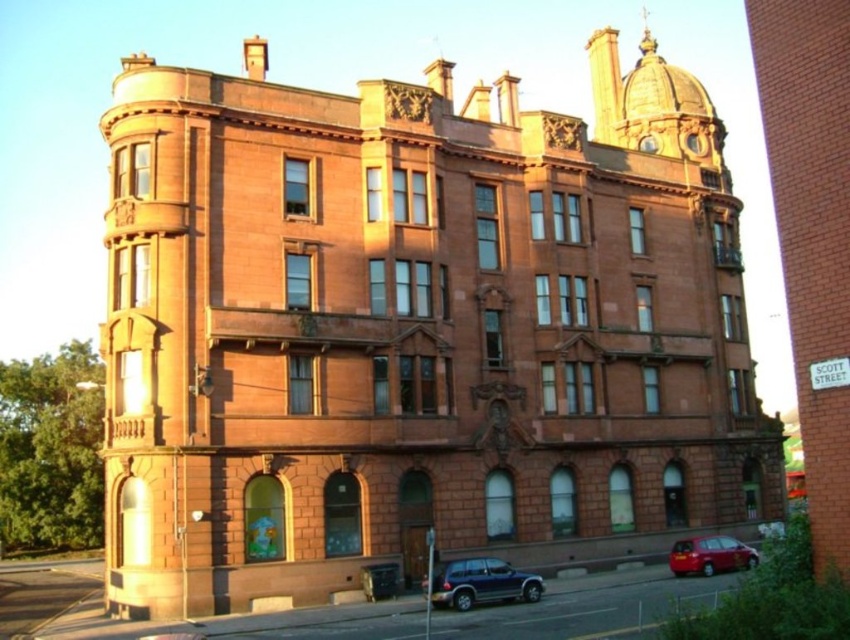
Which is more to the left, satin black suv at lower center or shiny red car at lower right?

satin black suv at lower center

Is point (435, 572) positioned in front of point (724, 561)?

Yes, point (435, 572) is closer to viewer.

Between point (482, 557) and point (704, 572), which one is positioned behind?

Positioned behind is point (704, 572).

The image size is (850, 640). Find the location of `satin black suv at lower center`. satin black suv at lower center is located at coordinates (480, 582).